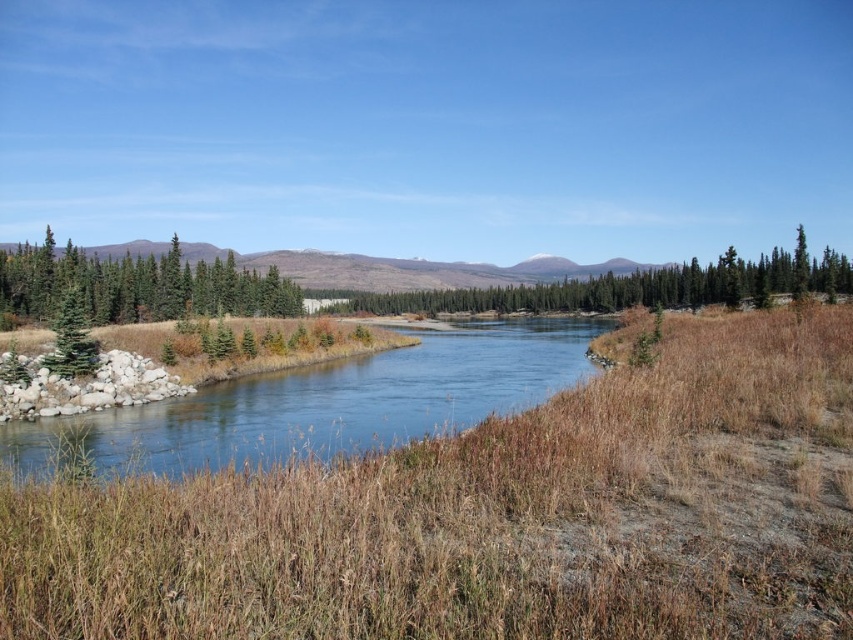
You are a hiker standing at the riverbank and want to take a photo of the brown dry grass at center and the green matte evergreen tree at left. Which object will appear closer to the camera in the photo?

The brown dry grass at center will appear closer to the camera in the photo because it is positioned in front of the green matte evergreen tree at left.